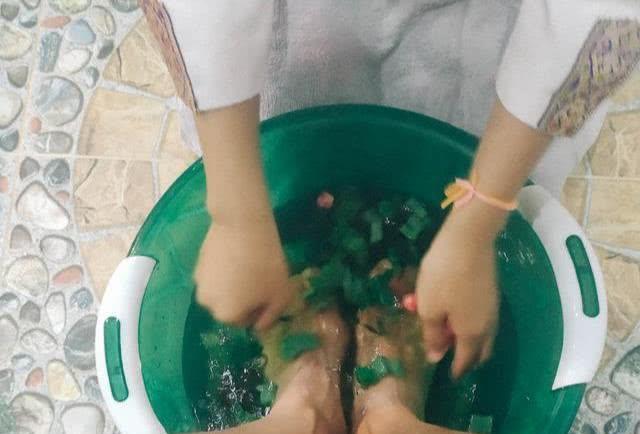
This screenshot has width=640, height=434. What are the coordinates of `floor` in the screenshot? It's located at (611, 164), (609, 386), (100, 61), (38, 313).